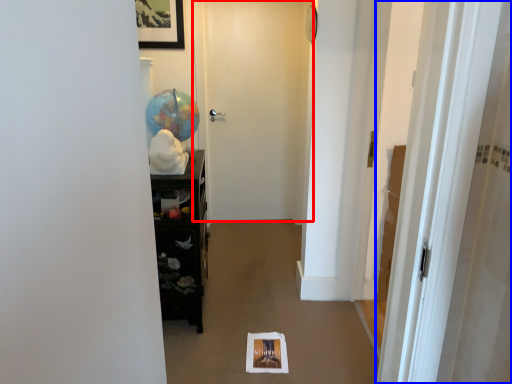
Question: Which point is further to the camera, door (highlighted by a red box) or door (highlighted by a blue box)?

Choices:
 (A) door
 (B) door

Answer: (A)